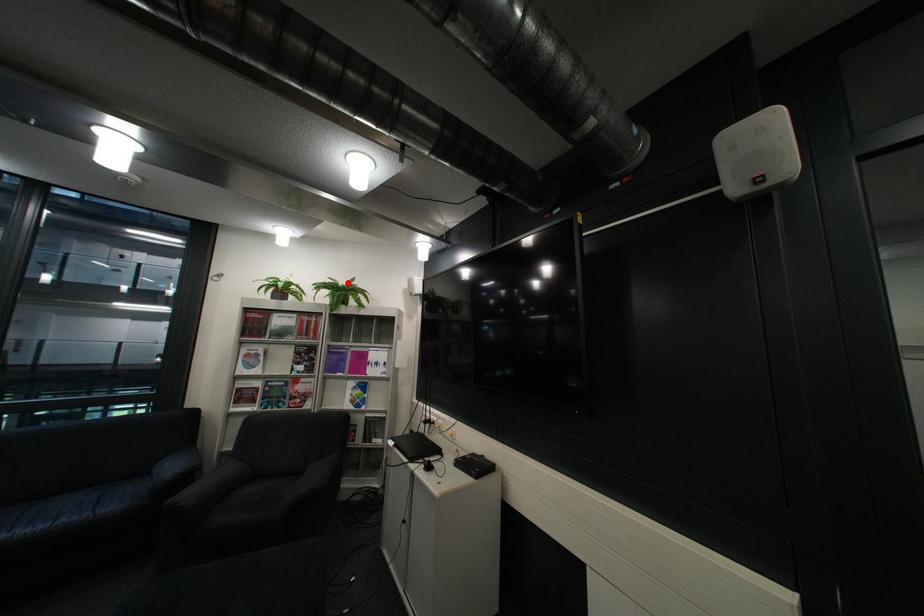
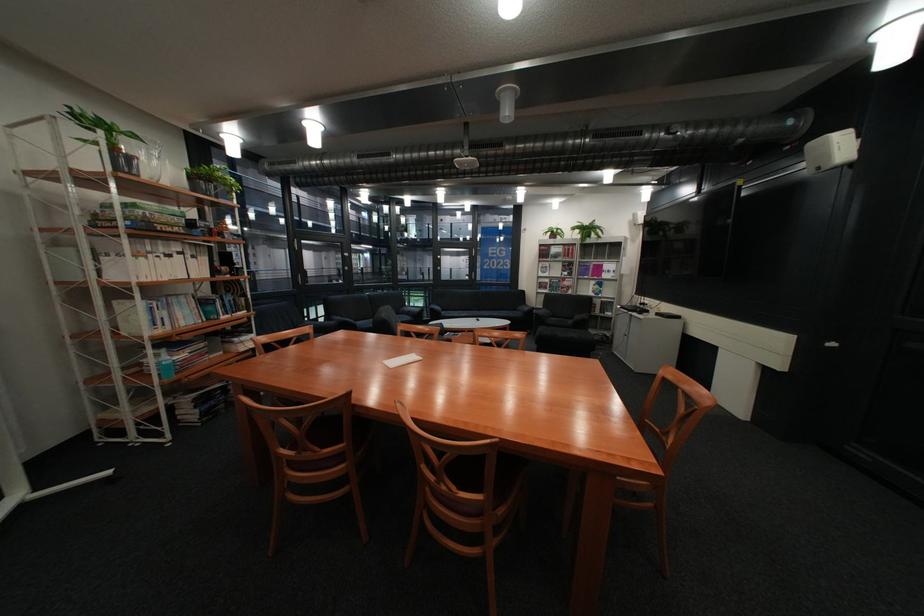
Where in the second image is the point corresponding to the highlighted location from the first image?

(594, 225)